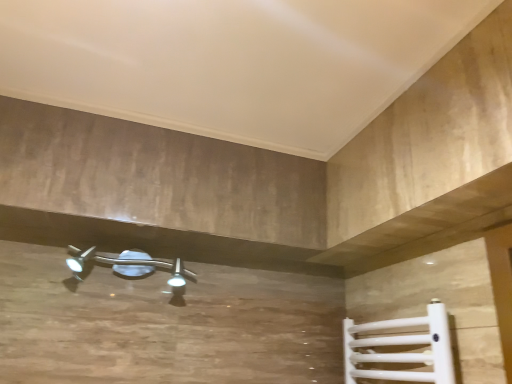
Locate an element on the screen. Image resolution: width=512 pixels, height=384 pixels. satin silver light fixture at lower center is located at coordinates (129, 264).

The width and height of the screenshot is (512, 384). What do you see at coordinates (129, 264) in the screenshot? I see `satin silver light fixture at lower center` at bounding box center [129, 264].

You are a GUI agent. You are given a task and a screenshot of the screen. Output one action in this format:
    pyautogui.click(x=<x>, y=<y>)
    Task: Click on the satin silver light fixture at lower center
    
    Given the screenshot: What is the action you would take?
    pyautogui.click(x=129, y=264)